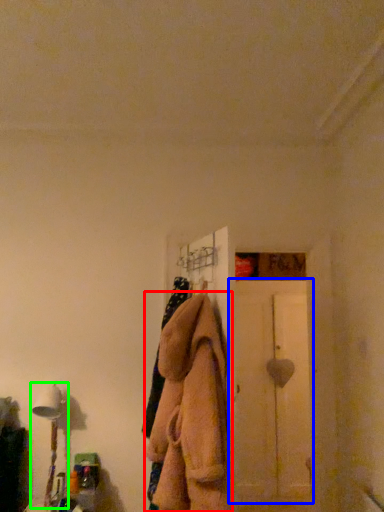
Question: Estimate the real-world distances between objects in this image. Which object is closer to clothing (highlighted by a red box), screen door (highlighted by a blue box) or table lamp (highlighted by a green box)?

Choices:
 (A) screen door
 (B) table lamp

Answer: (B)